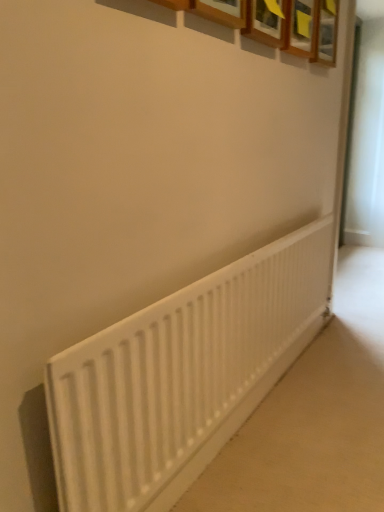
Question: Which direction should I rotate to look at wooden picture frame at upper center, the second picture frame in the front-to-back sequence?

Choices:
 (A) right
 (B) left

Answer: (A)

Question: Does white matte radiator at lower center have a lesser height compared to wooden frame at upper center, the 1th picture frame in the left-to-right sequence?

Choices:
 (A) yes
 (B) no

Answer: (B)

Question: Considering the relative sizes of white matte radiator at lower center and wooden frame at upper center, the 1th picture frame in the left-to-right sequence, in the image provided, is white matte radiator at lower center wider than wooden frame at upper center, the 1th picture frame in the left-to-right sequence,?

Choices:
 (A) no
 (B) yes

Answer: (A)

Question: Does white matte radiator at lower center have a lesser width compared to wooden frame at upper center, which is counted as the second picture frame, starting from the back?

Choices:
 (A) no
 (B) yes

Answer: (B)

Question: Is white matte radiator at lower center to the left of wooden frame at upper center, positioned as the 1th picture frame in front-to-back order, from the viewer's perspective?

Choices:
 (A) no
 (B) yes

Answer: (B)

Question: Does white matte radiator at lower center have a larger size compared to wooden frame at upper center, positioned as the 1th picture frame in front-to-back order?

Choices:
 (A) no
 (B) yes

Answer: (B)

Question: Considering the relative positions of white matte radiator at lower center and wooden frame at upper center, which is the second picture frame in right-to-left order, in the image provided, is white matte radiator at lower center to the right of wooden frame at upper center, which is the second picture frame in right-to-left order, from the viewer's perspective?

Choices:
 (A) no
 (B) yes

Answer: (A)

Question: Does wooden frame at upper center, the 1th picture frame in the left-to-right sequence, have a larger size compared to white matte radiator at lower center?

Choices:
 (A) no
 (B) yes

Answer: (A)

Question: Can you confirm if wooden frame at upper center, which is the second picture frame in right-to-left order, is shorter than white matte radiator at lower center?

Choices:
 (A) yes
 (B) no

Answer: (A)

Question: Is wooden frame at upper center, which is the second picture frame in right-to-left order, not close to white matte radiator at lower center?

Choices:
 (A) yes
 (B) no

Answer: (A)

Question: Is wooden frame at upper center, which is the second picture frame in right-to-left order, turned away from white matte radiator at lower center?

Choices:
 (A) yes
 (B) no

Answer: (B)

Question: Is wooden frame at upper center, the 1th picture frame in the left-to-right sequence, with white matte radiator at lower center?

Choices:
 (A) no
 (B) yes

Answer: (A)

Question: Is the depth of wooden frame at upper center, positioned as the 1th picture frame in front-to-back order, greater than that of white matte radiator at lower center?

Choices:
 (A) yes
 (B) no

Answer: (A)

Question: From a real-world perspective, is wooden frame at upper center, the 1th picture frame in the left-to-right sequence, under wooden picture frame at upper center, the second picture frame in the front-to-back sequence?

Choices:
 (A) yes
 (B) no

Answer: (A)